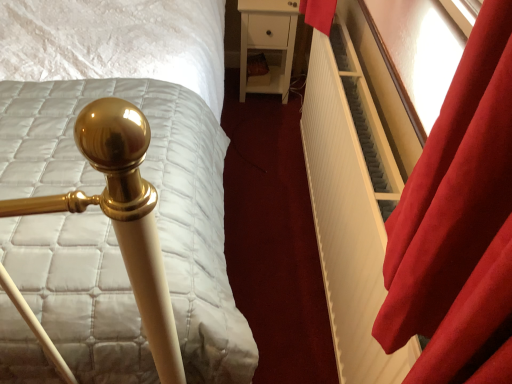
Question: Can you see white ribbed radiator at right touching white matte nightstand at center?

Choices:
 (A) no
 (B) yes

Answer: (A)

Question: Considering the relative positions of white ribbed radiator at right and white matte nightstand at center in the image provided, is white ribbed radiator at right to the right of white matte nightstand at center from the viewer's perspective?

Choices:
 (A) yes
 (B) no

Answer: (A)

Question: From a real-world perspective, is white ribbed radiator at right positioned over white matte nightstand at center based on gravity?

Choices:
 (A) yes
 (B) no

Answer: (A)

Question: Is there a large distance between white ribbed radiator at right and white matte nightstand at center?

Choices:
 (A) no
 (B) yes

Answer: (A)

Question: Is white ribbed radiator at right looking in the opposite direction of white matte nightstand at center?

Choices:
 (A) yes
 (B) no

Answer: (B)

Question: From the image's perspective, relative to velvet red curtain at right, is white ribbed radiator at right above or below?

Choices:
 (A) above
 (B) below

Answer: (B)

Question: Would you say white ribbed radiator at right is inside or outside velvet red curtain at right?

Choices:
 (A) outside
 (B) inside

Answer: (A)

Question: Is white ribbed radiator at right bigger or smaller than velvet red curtain at right?

Choices:
 (A) small
 (B) big

Answer: (B)

Question: Is white ribbed radiator at right taller or shorter than velvet red curtain at right?

Choices:
 (A) short
 (B) tall

Answer: (B)

Question: Considering the relative positions of white matte nightstand at center and gold polished bedpost at left in the image provided, is white matte nightstand at center to the left or to the right of gold polished bedpost at left?

Choices:
 (A) left
 (B) right

Answer: (B)

Question: Looking at their shapes, would you say white matte nightstand at center is wider or thinner than gold polished bedpost at left?

Choices:
 (A) wide
 (B) thin

Answer: (B)

Question: From the image's perspective, relative to gold polished bedpost at left, is white matte nightstand at center above or below?

Choices:
 (A) above
 (B) below

Answer: (A)

Question: Considering the positions of white matte nightstand at center and gold polished bedpost at left in the image, is white matte nightstand at center bigger or smaller than gold polished bedpost at left?

Choices:
 (A) small
 (B) big

Answer: (A)

Question: Looking at their shapes, would you say white ribbed radiator at right is wider or thinner than white matte nightstand at center?

Choices:
 (A) wide
 (B) thin

Answer: (B)

Question: From the image's perspective, is white ribbed radiator at right located above or below white matte nightstand at center?

Choices:
 (A) below
 (B) above

Answer: (A)